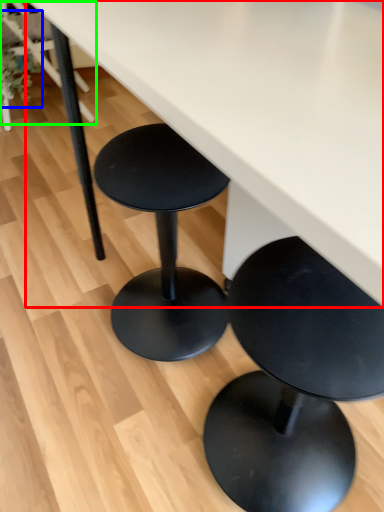
Question: Which is nearer to the table (highlighted by a red box)? plant (highlighted by a blue box) or chair (highlighted by a green box).

Choices:
 (A) plant
 (B) chair

Answer: (A)